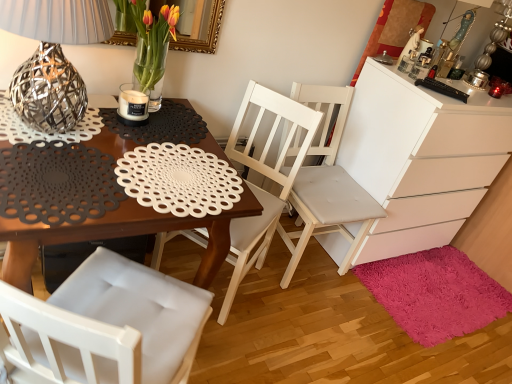
The image size is (512, 384). What are the coordinates of `empty space that is to the right of white matte candle at table` in the screenshot? It's located at (172, 133).